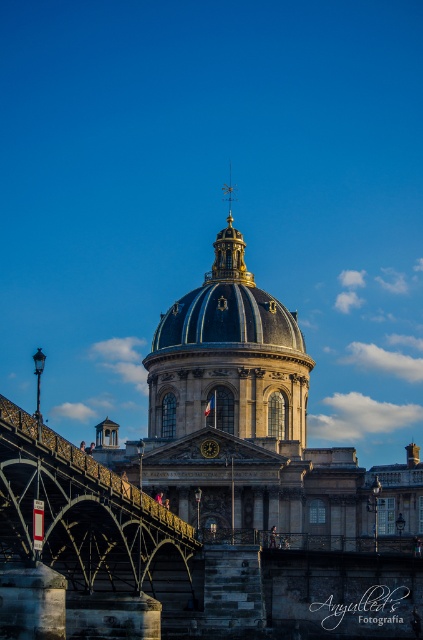
Between stone bridge at center and matte gold dome at center, which one is positioned lower?

Positioned lower is stone bridge at center.

Can you confirm if stone bridge at center is smaller than matte gold dome at center?

Indeed, stone bridge at center has a smaller size compared to matte gold dome at center.

Identify the location of stone bridge at center. point(87,534).

Is the position of blue stone dome at center less distant than that of matte gold dome at center?

Yes, it is in front of matte gold dome at center.

Measure the distance between point (22, 504) and camera.

A distance of 57.63 meters exists between point (22, 504) and camera.

The height and width of the screenshot is (640, 423). Identify the location of blue stone dome at center. tap(208, 497).

Who is lower down, blue stone dome at center or stone bridge at center?

stone bridge at center is lower down.

Can you confirm if blue stone dome at center is positioned to the right of stone bridge at center?

Yes, blue stone dome at center is to the right of stone bridge at center.

Who is more distant from viewer, [203,280] or [109,499]?

The point [203,280] is more distant.

At what (x,y) coordinates should I click in order to perform the action: click on blue stone dome at center. Please return your answer as a coordinate pair (x, y). Looking at the image, I should click on (208, 497).